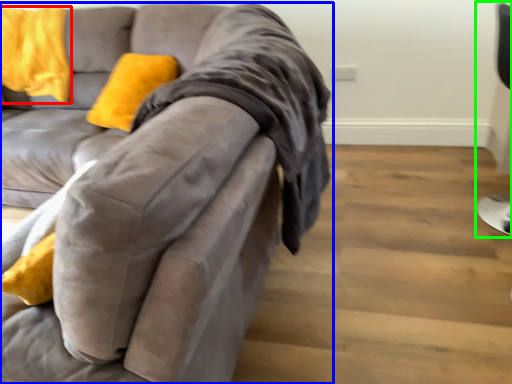
Question: Which object is the farthest from pillow (highlighted by a red box)? Choose among these: studio couch (highlighted by a blue box) or computer chair (highlighted by a green box).

Choices:
 (A) studio couch
 (B) computer chair

Answer: (B)